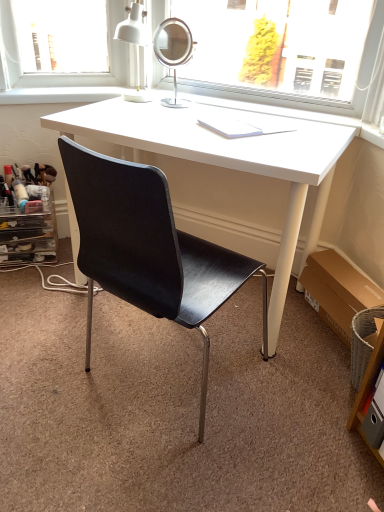
What is the approximate width of white paper at center?

white paper at center is 11.75 inches in width.

The image size is (384, 512). In order to click on white matte table lamp at upper center in this screenshot , I will do `click(135, 47)`.

Measure the distance between wooden shelf at lower right, marked as the 1th shelf in a front-to-back arrangement, and camera.

They are 1.15 meters apart.

At what (x,y) coordinates should I click in order to perform the action: click on white paper at center. Please return your answer as a coordinate pair (x, y). Looking at the image, I should click on (243, 124).

Can you tell me how much wooden shelf at lower right, which is counted as the 2th shelf, starting from the top, and brown cardboard box at lower right differ in facing direction?

0.17 degrees separate the facing orientations of wooden shelf at lower right, which is counted as the 2th shelf, starting from the top, and brown cardboard box at lower right.

Looking at this image, from the image's perspective, is wooden shelf at lower right, which ranks as the first shelf in bottom-to-top order, located above or below brown cardboard box at lower right?

Clearly, from the image's perspective, wooden shelf at lower right, which ranks as the first shelf in bottom-to-top order, is below brown cardboard box at lower right.

Which of these two, wooden shelf at lower right, which appears as the first shelf when viewed from the right, or brown cardboard box at lower right, is wider?

Wider between the two is brown cardboard box at lower right.

Which object is closer to the camera, clear plastic drawer at lower left, placed as the second shelf when sorted from right to left, or black leather chair at center?

black leather chair at center is closer to the camera.

Based on the photo, considering the sizes of objects clear plastic drawer at lower left, which is counted as the 2th shelf, starting from the front, and black leather chair at center in the image provided, who is smaller, clear plastic drawer at lower left, which is counted as the 2th shelf, starting from the front, or black leather chair at center?

With smaller size is clear plastic drawer at lower left, which is counted as the 2th shelf, starting from the front.

Is clear plastic drawer at lower left, which is the first shelf in left-to-right order, inside or outside of black leather chair at center?

clear plastic drawer at lower left, which is the first shelf in left-to-right order, is spatially situated outside black leather chair at center.

How different are the orientations of clear plastic drawer at lower left, which is counted as the 2th shelf, starting from the front, and black leather chair at center in degrees?

131 degrees.

Is black leather chair at center placed right next to wooden shelf at lower right, placed as the 2th shelf when sorted from back to front?

They are not placed beside each other.

Considering the sizes of objects black leather chair at center and wooden shelf at lower right, which ranks as the first shelf in bottom-to-top order, in the image provided, who is wider, black leather chair at center or wooden shelf at lower right, which ranks as the first shelf in bottom-to-top order,?

With larger width is black leather chair at center.

Where is `the 1st shelf behind the black leather chair at center`? This screenshot has width=384, height=512. the 1st shelf behind the black leather chair at center is located at coordinates (367, 384).

Is black leather chair at center taller than wooden shelf at lower right, placed as the 2th shelf when sorted from left to right?

Yes.

Is white glossy desk at center wider than black leather chair at center?

Yes, white glossy desk at center is wider than black leather chair at center.

In the image, is white glossy desk at center positioned in front of or behind black leather chair at center?

Clearly, white glossy desk at center is behind black leather chair at center.

Is white glossy desk at center not inside black leather chair at center?

Yes, white glossy desk at center is located beyond the bounds of black leather chair at center.

In the scene shown: Between white glossy desk at center and black leather chair at center, which one appears on the right side from the viewer's perspective?

white glossy desk at center.

Find the location of a particular element. Image resolution: width=384 pixels, height=512 pixels. shelf that appears behind the chrome/metallic mirror at upper center is located at coordinates (28, 234).

In terms of height, does chrome/metallic mirror at upper center look taller or shorter compared to clear plastic drawer at lower left, which is the first shelf in left-to-right order?

Clearly, chrome/metallic mirror at upper center is shorter compared to clear plastic drawer at lower left, which is the first shelf in left-to-right order.

Is chrome/metallic mirror at upper center facing away from clear plastic drawer at lower left, which is counted as the 2th shelf, starting from the front?

No, chrome/metallic mirror at upper center's orientation is not away from clear plastic drawer at lower left, which is counted as the 2th shelf, starting from the front.

From a real-world perspective, is chrome/metallic mirror at upper center above or below clear plastic drawer at lower left, the second shelf from the bottom?

chrome/metallic mirror at upper center is above clear plastic drawer at lower left, the second shelf from the bottom.

Considering the relative positions of clear plastic drawer at lower left, the second shelf from the bottom, and white paper at center in the image provided, is clear plastic drawer at lower left, the second shelf from the bottom, to the left of white paper at center from the viewer's perspective?

Correct, you'll find clear plastic drawer at lower left, the second shelf from the bottom, to the left of white paper at center.

From the image's perspective, who appears lower, clear plastic drawer at lower left, which is counted as the 2th shelf, starting from the front, or white paper at center?

From the image's view, clear plastic drawer at lower left, which is counted as the 2th shelf, starting from the front, is below.

Is clear plastic drawer at lower left, the second shelf from the bottom, positioned far away from white paper at center?

No.

Measure the distance between clear plastic drawer at lower left, positioned as the first shelf in back-to-front order, and white paper at center.

A distance of 96.26 centimeters exists between clear plastic drawer at lower left, positioned as the first shelf in back-to-front order, and white paper at center.

From a real-world perspective, is chrome/metallic mirror at upper center located higher than brown cardboard box at lower right?

Indeed, from a real-world perspective, chrome/metallic mirror at upper center stands above brown cardboard box at lower right.

From the image's perspective, is chrome/metallic mirror at upper center beneath brown cardboard box at lower right?

No, from the image's perspective, chrome/metallic mirror at upper center is not below brown cardboard box at lower right.

At what (x,y) coordinates should I click in order to perform the action: click on mirror that appears on the left of brown cardboard box at lower right. Please return your answer as a coordinate pair (x, y). Image resolution: width=384 pixels, height=512 pixels. Looking at the image, I should click on (173, 52).

Can you confirm if chrome/metallic mirror at upper center is positioned to the left of brown cardboard box at lower right?

Correct, you'll find chrome/metallic mirror at upper center to the left of brown cardboard box at lower right.

Identify the location of shelf above the brown cardboard box at lower right (from a real-world perspective). Image resolution: width=384 pixels, height=512 pixels. (367, 384).

I want to click on chair in front of the clear plastic drawer at lower left, positioned as the first shelf in back-to-front order, so click(x=148, y=249).

Which object lies further to the anchor point white paper at center, brown cardboard box at lower right or clear plastic drawer at lower left, which is counted as the 2th shelf, starting from the front?

clear plastic drawer at lower left, which is counted as the 2th shelf, starting from the front, is positioned further to the anchor white paper at center.

Considering their positions, is white paper at center positioned further to white matte table lamp at upper center than white glossy desk at center?

Among the two, white glossy desk at center is located further to white matte table lamp at upper center.

Estimate the real-world distances between objects in this image. Which object is closer to black leather chair at center, chrome/metallic mirror at upper center or wooden shelf at lower right, which is counted as the 2th shelf, starting from the top?

wooden shelf at lower right, which is counted as the 2th shelf, starting from the top, is closer to black leather chair at center.

Which object lies nearer to the anchor point black leather chair at center, wooden shelf at lower right, placed as the 2th shelf when sorted from back to front, or white paper at center?

Based on the image, white paper at center appears to be nearer to black leather chair at center.

Based on their spatial positions, is wooden shelf at lower right, which appears as the first shelf when viewed from the right, or white matte table lamp at upper center further from white glossy desk at center?

wooden shelf at lower right, which appears as the first shelf when viewed from the right, lies further to white glossy desk at center than the other object.

From the image, which object appears to be nearer to clear plastic drawer at lower left, positioned as the first shelf in back-to-front order, white matte table lamp at upper center or chrome/metallic mirror at upper center?

Based on the image, white matte table lamp at upper center appears to be nearer to clear plastic drawer at lower left, positioned as the first shelf in back-to-front order.

Which object lies further to the anchor point white paper at center, chrome/metallic mirror at upper center or white matte table lamp at upper center?

white matte table lamp at upper center.

Looking at the image, which one is located closer to chrome/metallic mirror at upper center, white matte table lamp at upper center or brown cardboard box at lower right?

Based on the image, white matte table lamp at upper center appears to be nearer to chrome/metallic mirror at upper center.

I want to click on mirror between black leather chair at center and clear plastic drawer at lower left, the second shelf from the bottom, along the z-axis, so (x=173, y=52).

Find the location of a particular element. Image resolution: width=384 pixels, height=512 pixels. desk between black leather chair at center and brown cardboard box at lower right from left to right is located at coordinates (224, 160).

Where is `book between clear plastic drawer at lower left, which is counted as the 2th shelf, starting from the front, and wooden shelf at lower right, placed as the 2th shelf when sorted from left to right, in the horizontal direction`? The width and height of the screenshot is (384, 512). book between clear plastic drawer at lower left, which is counted as the 2th shelf, starting from the front, and wooden shelf at lower right, placed as the 2th shelf when sorted from left to right, in the horizontal direction is located at coordinates 243,124.

Where is `desk between chrome/metallic mirror at upper center and brown cardboard box at lower right in the vertical direction`? This screenshot has width=384, height=512. desk between chrome/metallic mirror at upper center and brown cardboard box at lower right in the vertical direction is located at coordinates (224, 160).